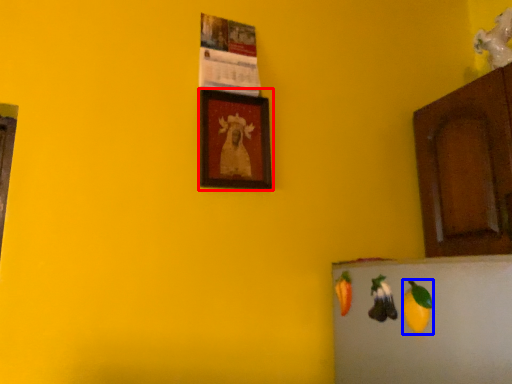
Question: Which point is further to the camera, picture frame (highlighted by a red box) or fruit (highlighted by a blue box)?

Choices:
 (A) picture frame
 (B) fruit

Answer: (A)